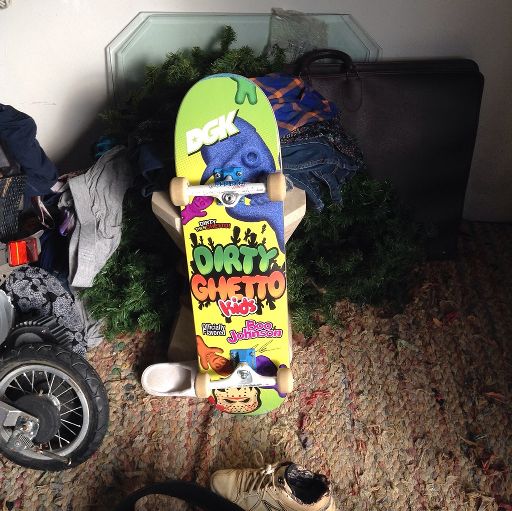
Where is `carpet`? The height and width of the screenshot is (511, 512). carpet is located at coordinates (404, 393), (213, 427), (119, 416).